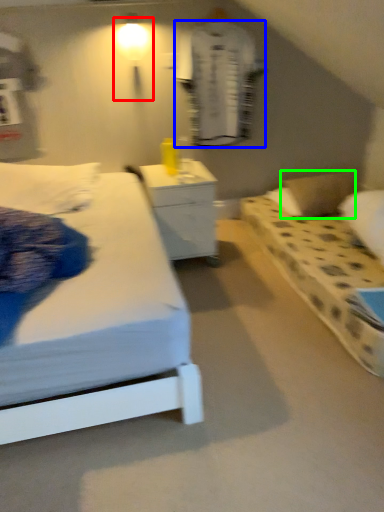
Question: Which object is the farthest from light fixture (highlighted by a red box)? Choose among these: robe (highlighted by a blue box) or pillow (highlighted by a green box).

Choices:
 (A) robe
 (B) pillow

Answer: (B)